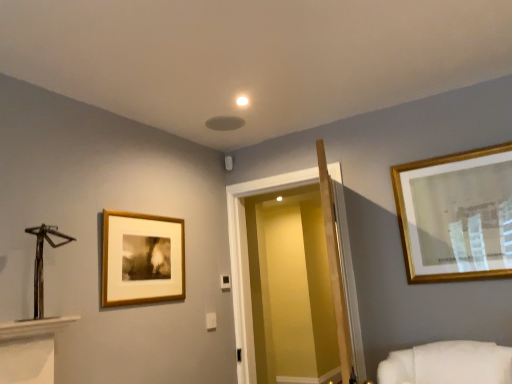
What is the approximate height of wooden framed print at left?

wooden framed print at left is 19.17 inches in height.

This screenshot has width=512, height=384. In order to click on wooden framed print at left in this screenshot , I will do `click(142, 259)`.

This screenshot has width=512, height=384. Describe the element at coordinates (142, 259) in the screenshot. I see `wooden framed print at left` at that location.

What do you see at coordinates (290, 287) in the screenshot?
I see `transparent glass door at center` at bounding box center [290, 287].

From the picture: Measure the distance between transparent glass door at center and camera.

transparent glass door at center is 3.29 meters from camera.

Locate an element on the screen. transparent glass door at center is located at coordinates (290, 287).

The height and width of the screenshot is (384, 512). Find the location of `wooden framed print at left`. wooden framed print at left is located at coordinates (142, 259).

Is wooden framed print at left at the right side of transparent glass door at center?

No.

Is the depth of wooden framed print at left less than that of transparent glass door at center?

Yes, wooden framed print at left is closer to the viewer.

Is point (132, 288) less distant than point (301, 314)?

Yes, point (132, 288) is closer to viewer.

From the image's perspective, is wooden framed print at left on top of transparent glass door at center?

Yes.

From a real-world perspective, between wooden framed print at left and transparent glass door at center, who is vertically higher?

In real-world perspective, wooden framed print at left is above.

In terms of width, does wooden framed print at left look wider or thinner when compared to transparent glass door at center?

Clearly, wooden framed print at left has less width compared to transparent glass door at center.

Considering the relative sizes of wooden framed print at left and transparent glass door at center in the image provided, is wooden framed print at left taller than transparent glass door at center?

Incorrect, the height of wooden framed print at left is not larger of that of transparent glass door at center.

Is wooden framed print at left bigger or smaller than transparent glass door at center?

In the image, wooden framed print at left appears to be smaller than transparent glass door at center.

Is wooden framed print at left situated inside transparent glass door at center or outside?

The correct answer is: outside.

Would you consider wooden framed print at left to be distant from transparent glass door at center?

wooden framed print at left is far away from transparent glass door at center.

Could you tell me if wooden framed print at left is turned towards transparent glass door at center?

No, wooden framed print at left is not oriented towards transparent glass door at center.

The height and width of the screenshot is (384, 512). In order to click on picture frame in front of the transparent glass door at center in this screenshot , I will do `click(142, 259)`.

Which is more to the right, transparent glass door at center or wooden framed print at left?

From the viewer's perspective, transparent glass door at center appears more on the right side.

Is the position of transparent glass door at center more distant than that of wooden framed print at left?

Yes, it is.

Does point (261, 276) appear closer or farther from the camera than point (105, 256)?

Point (261, 276) is farther from the camera than point (105, 256).

From the image's perspective, between transparent glass door at center and wooden framed print at left, which one is located above?

wooden framed print at left, from the image's perspective.

From a real-world perspective, is transparent glass door at center below wooden framed print at left?

Yes, from a real-world perspective, transparent glass door at center is under wooden framed print at left.

Which object is wider, transparent glass door at center or wooden framed print at left?

transparent glass door at center is wider.

Looking at this image, who is shorter, transparent glass door at center or wooden framed print at left?

wooden framed print at left is shorter.

Between transparent glass door at center and wooden framed print at left, which one has smaller size?

wooden framed print at left.

Is transparent glass door at center completely or partially outside of wooden framed print at left?

Yes.

In the scene shown: Are transparent glass door at center and wooden framed print at left making contact?

transparent glass door at center and wooden framed print at left are not in contact.

Is transparent glass door at center oriented towards wooden framed print at left?

Yes, transparent glass door at center is aimed at wooden framed print at left.

How far apart are transparent glass door at center and wooden framed print at left?

transparent glass door at center is 5.69 feet from wooden framed print at left.

You are a GUI agent. You are given a task and a screenshot of the screen. Output one action in this format:
    pyautogui.click(x=<x>, y=<y>)
    Task: Click on the glass door on the right side of wooden framed print at left
    
    Given the screenshot: What is the action you would take?
    pyautogui.click(x=290, y=287)

Find the location of a particular element. This screenshot has height=384, width=512. picture frame that appears in front of the transparent glass door at center is located at coordinates (142, 259).

Locate an element on the screen. This screenshot has height=384, width=512. glass door on the right of wooden framed print at left is located at coordinates 290,287.